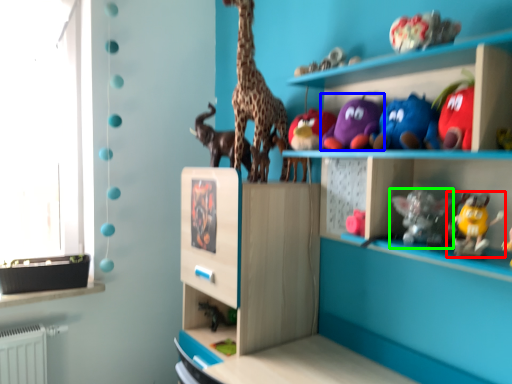
Question: Which is nearer to the toy (highlighted by a red box)? toy (highlighted by a blue box) or toy (highlighted by a green box).

Choices:
 (A) toy
 (B) toy

Answer: (B)